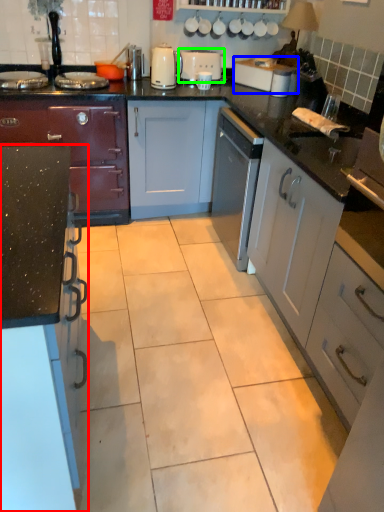
Question: Which is farther away from cabinetry (highlighted by a red box)? toaster (highlighted by a blue box) or appliance (highlighted by a green box)?

Choices:
 (A) toaster
 (B) appliance

Answer: (B)